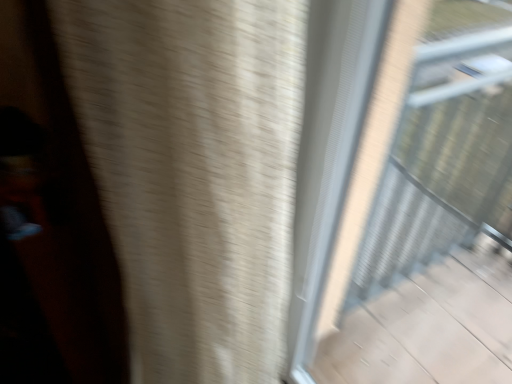
Find the location of `transparent glass window at upper right`. transparent glass window at upper right is located at coordinates (405, 192).

The width and height of the screenshot is (512, 384). Describe the element at coordinates (405, 192) in the screenshot. I see `transparent glass window at upper right` at that location.

Where is `transparent glass window at upper right`? This screenshot has width=512, height=384. transparent glass window at upper right is located at coordinates (405, 192).